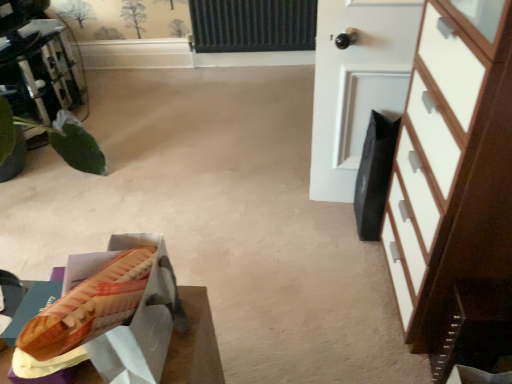
Question: In terms of width, does white matte door at upper right look wider or thinner when compared to matte brown hot dog bun at lower left?

Choices:
 (A) thin
 (B) wide

Answer: (A)

Question: Visually, is white matte door at upper right positioned to the left or to the right of matte brown hot dog bun at lower left?

Choices:
 (A) right
 (B) left

Answer: (A)

Question: Which object is the farthest from the matte brown hot dog bun at lower left?

Choices:
 (A) green leafy plant at left
 (B) white matte door at upper right
 (C) white wood chest of drawers at right

Answer: (A)

Question: Which object is positioned farthest from the matte brown hot dog bun at lower left?

Choices:
 (A) green leafy plant at left
 (B) white wood chest of drawers at right
 (C) white matte door at upper right

Answer: (A)